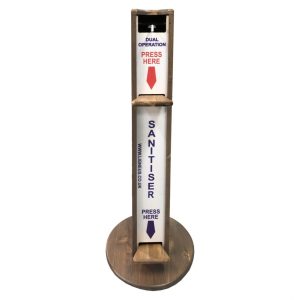
The image size is (300, 300). Find the location of `sanitiser`. sanitiser is located at coordinates coord(150,128).